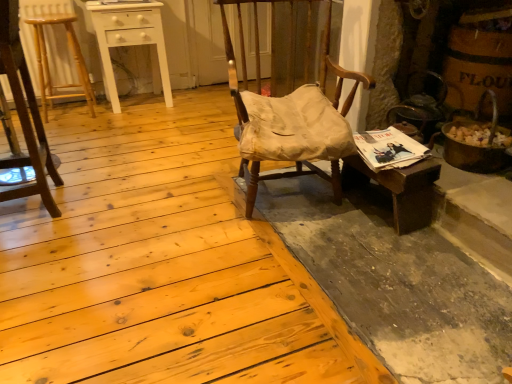
Locate an element on the screen. free space that is to the left of wooden desk at right is located at coordinates (312, 211).